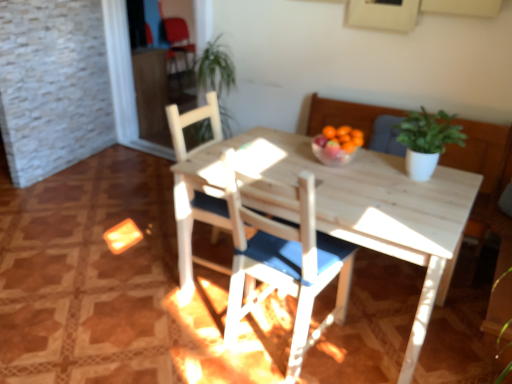
Question: Is point (186, 67) closer or farther from the camera than point (244, 291)?

Choices:
 (A) farther
 (B) closer

Answer: (A)

Question: In the image, is matte red armchair at upper left on the left side or the right side of white wood chair at center, the second chair when ordered from back to front?

Choices:
 (A) right
 (B) left

Answer: (B)

Question: Which is nearer to the white wood chair at center, the first chair positioned from the back?

Choices:
 (A) green matte plant at upper right
 (B) matte red armchair at upper left
 (C) white wood chair at center, the second chair when ordered from back to front

Answer: (C)

Question: Which of these objects is positioned closest to the white wood chair at center, the second chair when ordered from back to front?

Choices:
 (A) white wood chair at center, the first chair positioned from the back
 (B) green matte plant at upper right
 (C) matte red armchair at upper left

Answer: (A)